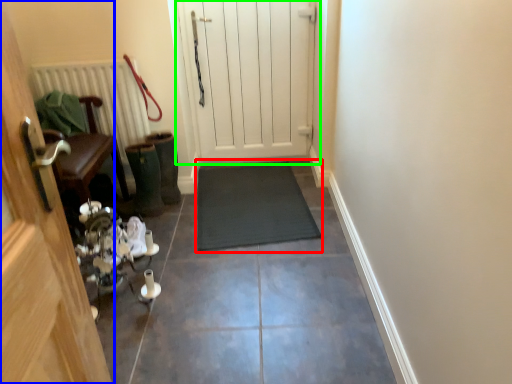
Question: Which object is the closest to the doormat (highlighted by a red box)? Choose among these: door (highlighted by a blue box) or door (highlighted by a green box).

Choices:
 (A) door
 (B) door

Answer: (B)